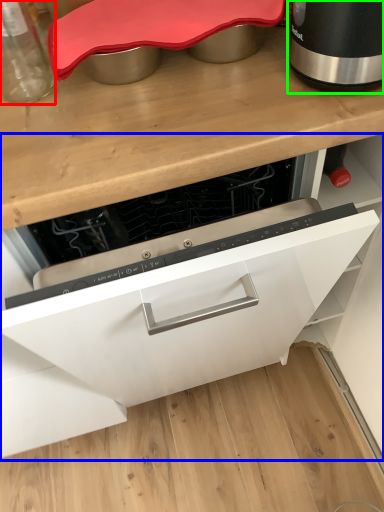
Question: Which object is the farthest from kitchen appliance (highlighted by a red box)? Choose among these: cabinetry (highlighted by a blue box) or home appliance (highlighted by a green box).

Choices:
 (A) cabinetry
 (B) home appliance

Answer: (A)